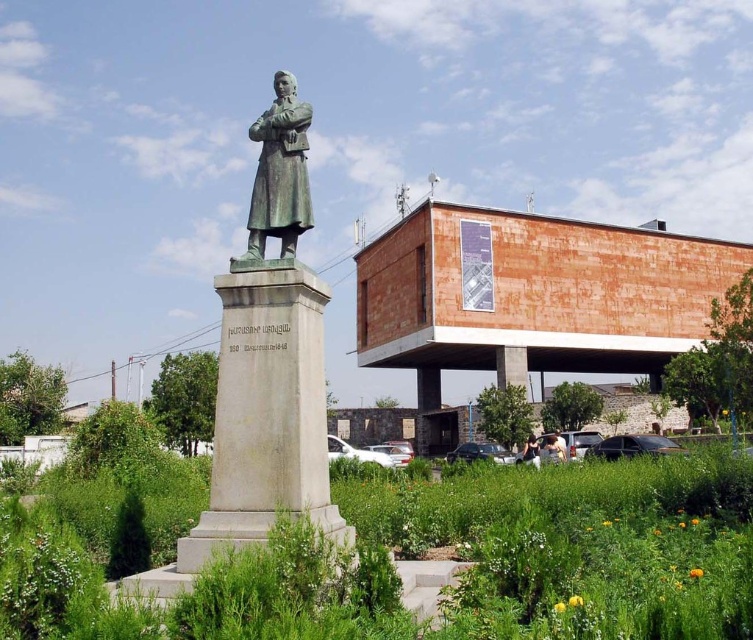
Between green bronze statue at center and light brown leather jacket at lower center, which one has less height?

Standing shorter between the two is green bronze statue at center.

Where is `green bronze statue at center`? green bronze statue at center is located at coordinates (270, 358).

Which of these two, green bronze statue at center or bronze statue at center, stands shorter?

green bronze statue at center is shorter.

Who is more distant from viewer, (258,429) or (284,241)?

Positioned behind is point (284,241).

Identify the location of green bronze statue at center. This screenshot has width=753, height=640. (270, 358).

Is bronze statue at center to the right of light brown leather jacket at lower center from the viewer's perspective?

In fact, bronze statue at center is to the left of light brown leather jacket at lower center.

Who is more distant from viewer, (306, 195) or (550, 436)?

The point (550, 436) is behind.

This screenshot has width=753, height=640. Find the location of `bronze statue at center`. bronze statue at center is located at coordinates (279, 173).

The image size is (753, 640). Identify the location of bronze statue at center. (279, 173).